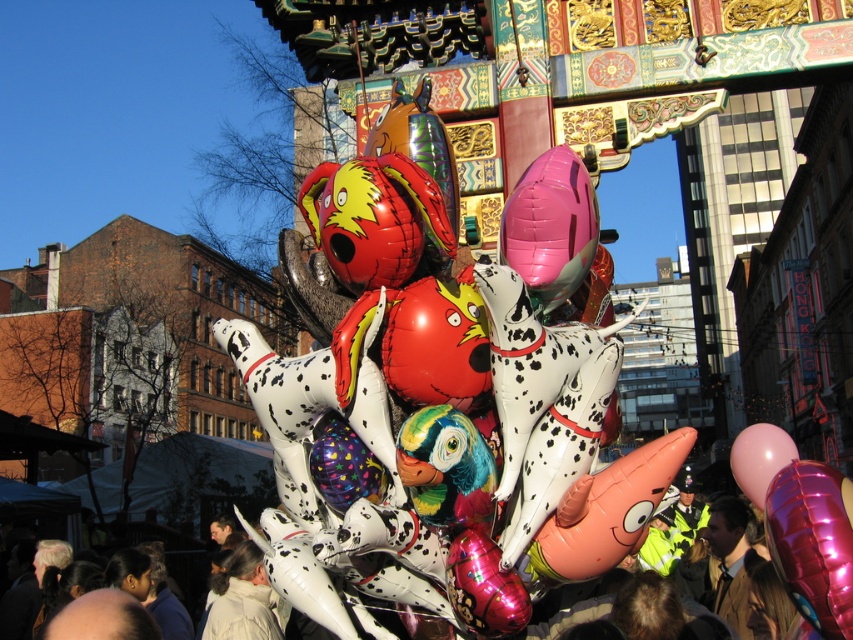
Question: Is pink glossy balloon at center to the left of light beige jacket at lower center from the viewer's perspective?

Choices:
 (A) yes
 (B) no

Answer: (B)

Question: Does light beige jacket at lower center appear on the left side of brown leather jacket at lower right?

Choices:
 (A) yes
 (B) no

Answer: (A)

Question: Is glossy metallic balloon at center smaller than light beige jacket at lower center?

Choices:
 (A) yes
 (B) no

Answer: (A)

Question: Which object is closer to the camera taking this photo?

Choices:
 (A) brown leather jacket at lower right
 (B) pink glossy balloon at center

Answer: (B)

Question: Considering the real-world distances, which object is closest to the pink glossy balloon at center?

Choices:
 (A) glossy metallic balloon at center
 (B) brown leather jacket at lower right
 (C) pink glossy balloon at right

Answer: (A)

Question: Which point is closer to the camera?

Choices:
 (A) (744, 476)
 (B) (566, 204)
 (C) (753, 554)
 (D) (809, 502)

Answer: (D)